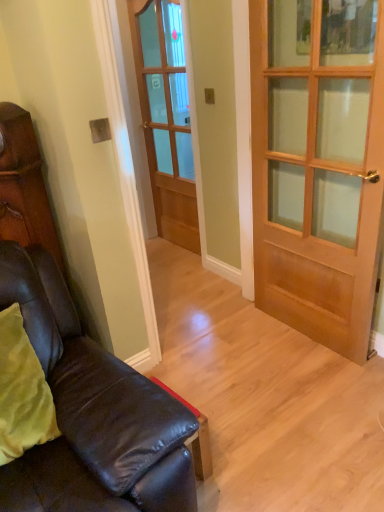
Question: Can you confirm if wooden glass door at center, positioned as the 2th door in front-to-back order, is wider than leather couch at lower left?

Choices:
 (A) no
 (B) yes

Answer: (A)

Question: From a real-world perspective, does wooden glass door at center, the first door from the back, sit lower than leather couch at lower left?

Choices:
 (A) yes
 (B) no

Answer: (B)

Question: From the image's perspective, is wooden glass door at center, positioned as the 2th door in front-to-back order, below leather couch at lower left?

Choices:
 (A) no
 (B) yes

Answer: (A)

Question: Is wooden glass door at center, positioned as the 2th door in front-to-back order, not near leather couch at lower left?

Choices:
 (A) no
 (B) yes

Answer: (B)

Question: Considering the relative sizes of wooden glass door at center, the first door in the left-to-right sequence, and leather couch at lower left in the image provided, is wooden glass door at center, the first door in the left-to-right sequence, smaller than leather couch at lower left?

Choices:
 (A) no
 (B) yes

Answer: (B)

Question: Is wooden door at center, placed as the 2th door when sorted from left to right, situated inside matte brown cabinet at left or outside?

Choices:
 (A) inside
 (B) outside

Answer: (B)

Question: In the image, is wooden door at center, arranged as the first door when viewed from the front, on the left side or the right side of matte brown cabinet at left?

Choices:
 (A) right
 (B) left

Answer: (A)

Question: In the image, is wooden door at center, arranged as the second door when viewed from the back, positioned in front of or behind matte brown cabinet at left?

Choices:
 (A) front
 (B) behind

Answer: (A)

Question: From the image's perspective, is wooden door at center, arranged as the second door when viewed from the back, positioned above or below matte brown cabinet at left?

Choices:
 (A) below
 (B) above

Answer: (B)

Question: From the image's perspective, is wooden door at center, arranged as the second door when viewed from the back, positioned above or below leather couch at lower left?

Choices:
 (A) below
 (B) above

Answer: (B)

Question: Looking at their shapes, would you say wooden door at center, placed as the 2th door when sorted from left to right, is wider or thinner than leather couch at lower left?

Choices:
 (A) wide
 (B) thin

Answer: (B)

Question: Is point (299, 159) closer or farther from the camera than point (16, 483)?

Choices:
 (A) farther
 (B) closer

Answer: (A)

Question: Is wooden door at center, which is counted as the first door, starting from the right, in front of or behind leather couch at lower left in the image?

Choices:
 (A) behind
 (B) front

Answer: (A)

Question: Is wooden glass door at center, the first door from the back, bigger or smaller than leather couch at lower left?

Choices:
 (A) big
 (B) small

Answer: (B)

Question: From the image's perspective, is wooden glass door at center, the first door from the back, located above or below leather couch at lower left?

Choices:
 (A) below
 (B) above

Answer: (B)